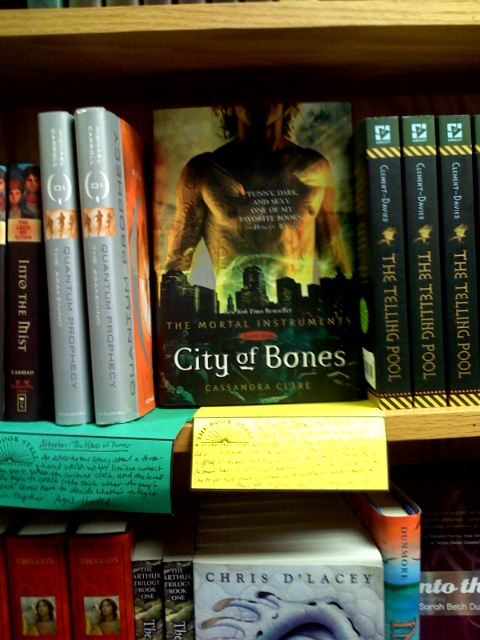
What are the coordinates of `bookshelf` in the screenshot? It's located at (228, 18).